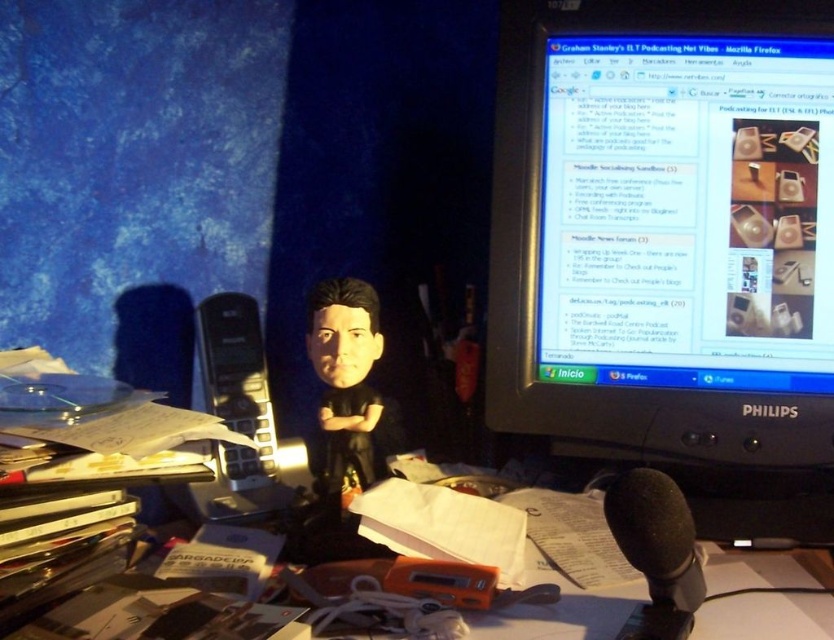
From the picture: What are the coordinates of the black plastic monitor at upper right in the image?

The coordinates of the black plastic monitor at upper right are at point [671,246].

You are setting up a camera to film a podcast session. The camera is placed at eye level and needs to capture both the black plastic monitor at upper right and the matte black microphone at center clearly. Which object will appear taller in the camera frame?

The black plastic monitor at upper right will appear taller in the camera frame since it has a greater height compared to the matte black microphone at center.